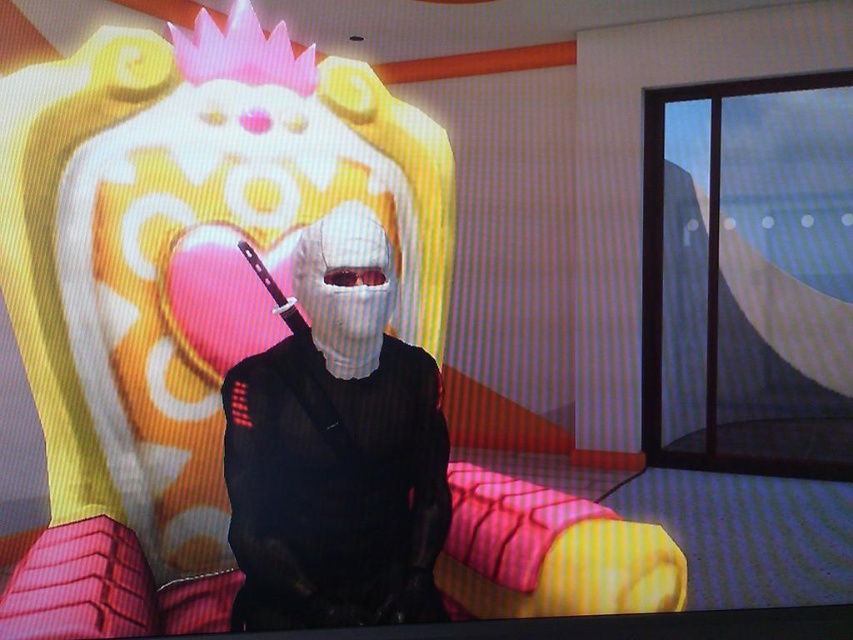
How distant is white matte mask at center from matte black knife at center?

A distance of 26.69 centimeters exists between white matte mask at center and matte black knife at center.

Does point (326, 321) lie in front of point (248, 250)?

That is True.

Is point (282, 372) positioned in front of point (281, 300)?

Yes, point (282, 372) is in front of point (281, 300).

Locate an element on the screen. white matte mask at center is located at coordinates (335, 451).